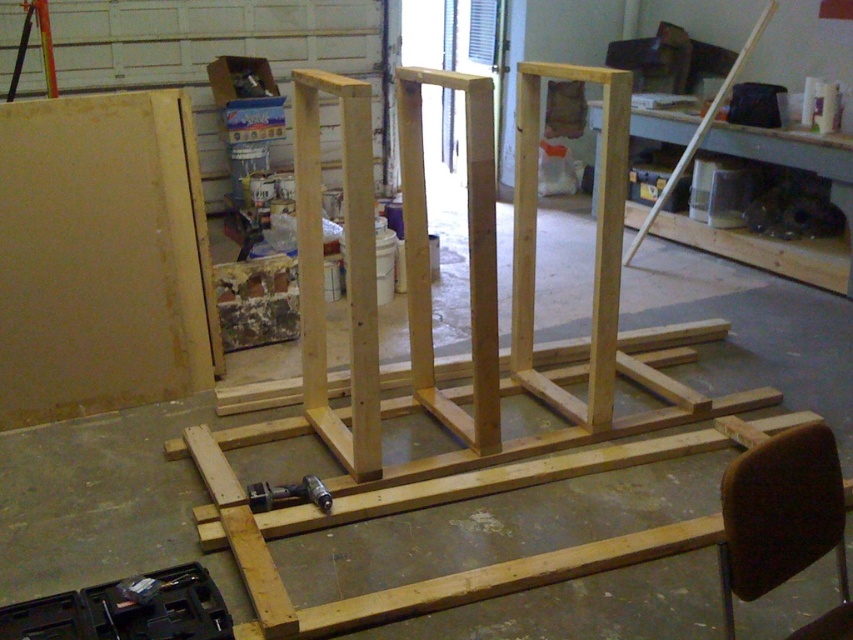
Does point (782, 132) come behind point (322, 492)?

Yes.

Is light wood workbench at upper right shorter than metallic gray drill at center?

No, light wood workbench at upper right is not shorter than metallic gray drill at center.

Between point (718, 136) and point (250, 492), which one is positioned behind?

Positioned behind is point (718, 136).

This screenshot has width=853, height=640. I want to click on light wood workbench at upper right, so click(x=780, y=241).

Who is higher up, black plastic tool box at lower left or metallic gray drill at center?

metallic gray drill at center is above.

Which is in front, point (97, 612) or point (259, 500)?

Point (97, 612)

Locate an element on the screen. This screenshot has width=853, height=640. black plastic tool box at lower left is located at coordinates (126, 609).

Does matte yellow wood at left have a smaller size compared to light wood workbench at upper right?

Yes, matte yellow wood at left is smaller than light wood workbench at upper right.

Measure the distance between matte yellow wood at left and camera.

A distance of 2.97 meters exists between matte yellow wood at left and camera.

What do you see at coordinates (102, 257) in the screenshot? This screenshot has height=640, width=853. I see `matte yellow wood at left` at bounding box center [102, 257].

Where is `matte yellow wood at left`? This screenshot has height=640, width=853. matte yellow wood at left is located at coordinates (102, 257).